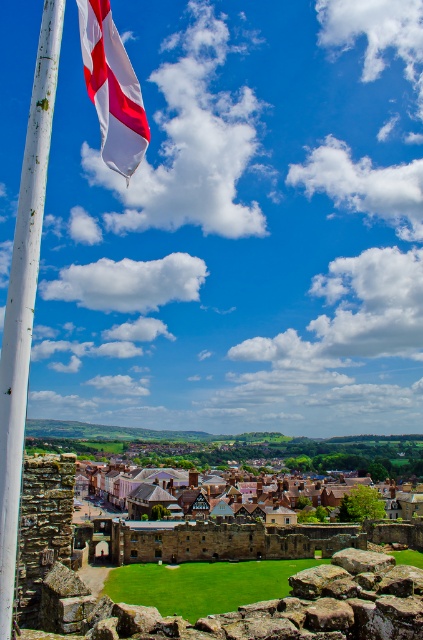
Is the position of white wood pole at left less distant than that of brown wooden houses at center?

Yes, it is in front of brown wooden houses at center.

From the picture: Which of these two, white wood pole at left or brown wooden houses at center, stands taller?

brown wooden houses at center is taller.

Locate an element on the screen. Image resolution: width=423 pixels, height=640 pixels. white wood pole at left is located at coordinates (24, 298).

This screenshot has height=640, width=423. I want to click on white wood pole at left, so click(24, 298).

Is point (21, 280) in front of point (140, 125)?

Yes, it is in front of point (140, 125).

Does point (2, 477) come farther from viewer compared to point (131, 141)?

No, it is not.

The image size is (423, 640). In order to click on white wood pole at left in this screenshot , I will do `click(24, 298)`.

Is white matte flag at upper left shorter than brown wooden houses at center?

Indeed, white matte flag at upper left has a lesser height compared to brown wooden houses at center.

Is white matte flag at upper left bigger than brown wooden houses at center?

Result: Incorrect, white matte flag at upper left is not larger than brown wooden houses at center.

Measure the distance between point (142,138) and camera.

The distance of point (142,138) from camera is 36.19 meters.

At what (x,y) coordinates should I click in order to perform the action: click on white matte flag at upper left. Please return your answer as a coordinate pair (x, y). The width and height of the screenshot is (423, 640). Looking at the image, I should click on (112, 88).